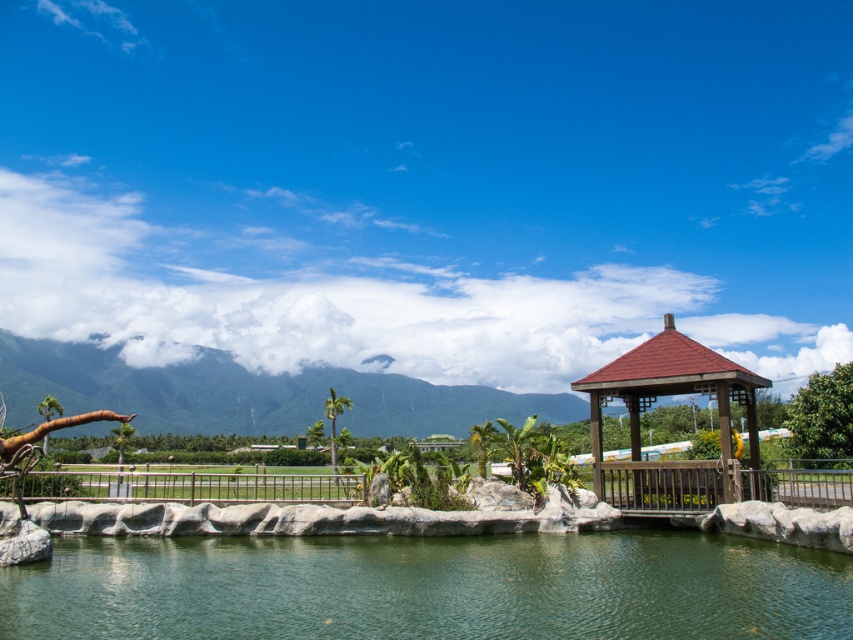
Question: Can you confirm if green smooth water at center is thinner than brown wooden gazebo at center-right?

Choices:
 (A) yes
 (B) no

Answer: (B)

Question: Which object is farther from the camera taking this photo?

Choices:
 (A) green smooth water at center
 (B) brown wooden gazebo at center-right

Answer: (B)

Question: Can you confirm if green smooth water at center is positioned below brown wooden gazebo at center-right?

Choices:
 (A) yes
 (B) no

Answer: (A)

Question: Which object is closer to the camera taking this photo?

Choices:
 (A) brown wooden gazebo at center-right
 (B) green smooth water at center

Answer: (B)

Question: From the image, what is the correct spatial relationship of green smooth water at center in relation to brown wooden gazebo at center-right?

Choices:
 (A) above
 (B) below

Answer: (B)